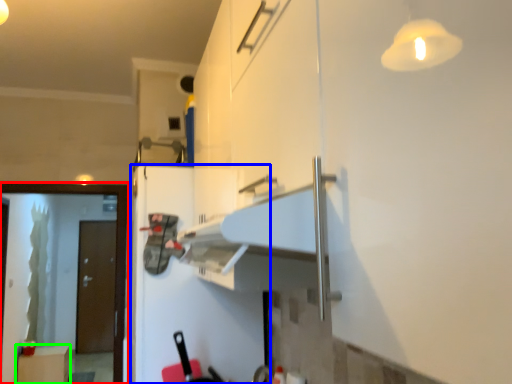
Question: Considering the real-world distances, which object is farthest from screen door (highlighted by a red box)? fridge (highlighted by a blue box) or cabinetry (highlighted by a green box)?

Choices:
 (A) fridge
 (B) cabinetry

Answer: (B)